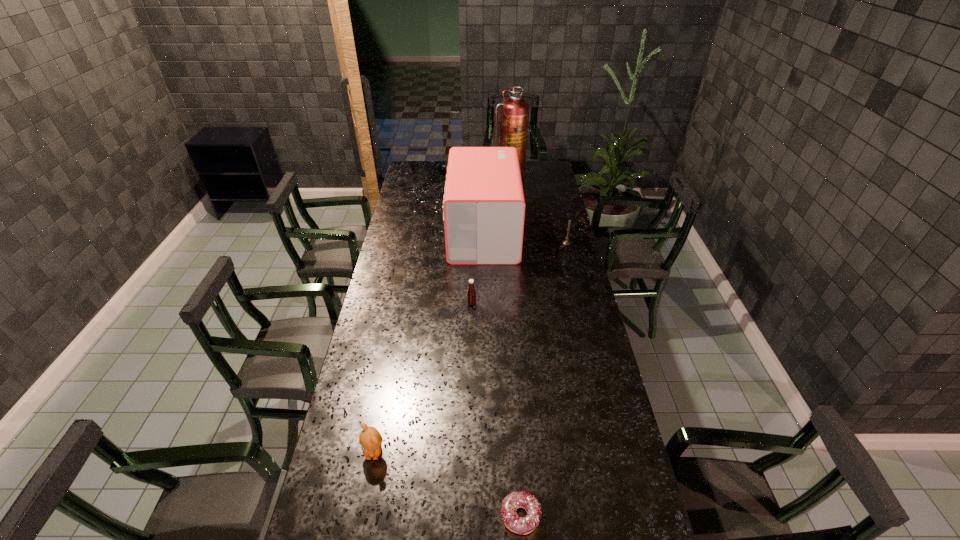
Locate an element on the screen. The width and height of the screenshot is (960, 540). vacant area that lies between the Tabasco sauce and the second tallest object is located at coordinates (477, 268).

I want to click on the third closest object relative to the farthest object, so click(x=471, y=293).

Identify which object is located as the third nearest to the candle. Please provide its 2D coordinates. Your answer should be formatted as a tuple, i.e. [(x, y)], where the tuple contains the x and y coordinates of a point satisfying the conditions above.

[(471, 293)]

Where is `free space that satisfies the following two spatial constraints: 1. on the surface of the fifth shortest object where the text is embossed; 2. on the right side of the doughnut`? This screenshot has width=960, height=540. free space that satisfies the following two spatial constraints: 1. on the surface of the fifth shortest object where the text is embossed; 2. on the right side of the doughnut is located at coordinates (486, 516).

Find the location of a particular element. The height and width of the screenshot is (540, 960). free point that satisfies the following two spatial constraints: 1. on the face of the leftmost object; 2. on the left side of the doughnut is located at coordinates (362, 516).

Where is `blank area in the image that satisfies the following two spatial constraints: 1. on the surface of the fifth shortest object where the text is embossed; 2. on the face of the fifth farthest object`? blank area in the image that satisfies the following two spatial constraints: 1. on the surface of the fifth shortest object where the text is embossed; 2. on the face of the fifth farthest object is located at coordinates (486, 451).

Find the location of `free space that satisfies the following two spatial constraints: 1. on the surface of the box where the text is embossed; 2. on the face of the second nearest object`. free space that satisfies the following two spatial constraints: 1. on the surface of the box where the text is embossed; 2. on the face of the second nearest object is located at coordinates (486, 451).

You are a GUI agent. You are given a task and a screenshot of the screen. Output one action in this format:
    pyautogui.click(x=<x>, y=<y>)
    Task: Click on the vacant space that satisfies the following two spatial constraints: 1. on the surface of the box where the text is embossed; 2. on the right side of the candle
    
    Given the screenshot: What is the action you would take?
    pyautogui.click(x=484, y=242)

Locate an element on the screen. The image size is (960, 540). vacant position in the image that satisfies the following two spatial constraints: 1. on the face of the shortest object; 2. on the right side of the teddy bear is located at coordinates (362, 516).